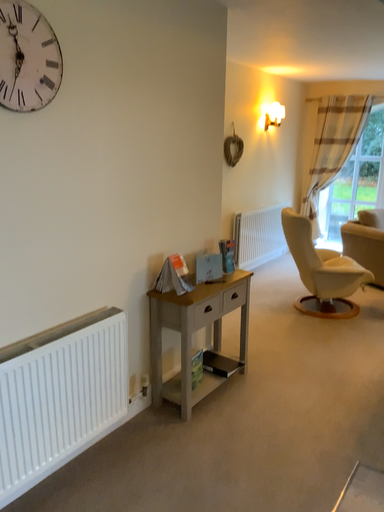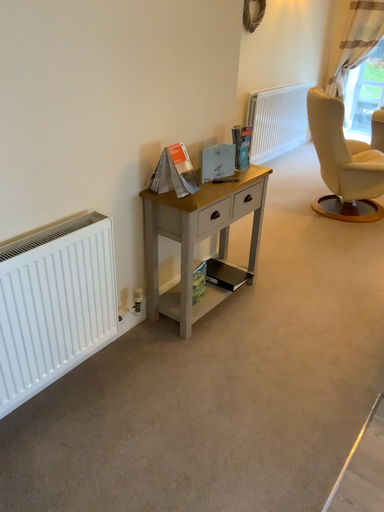
Question: Which way did the camera rotate in the video?

Choices:
 (A) rotated downward
 (B) rotated upward

Answer: (A)